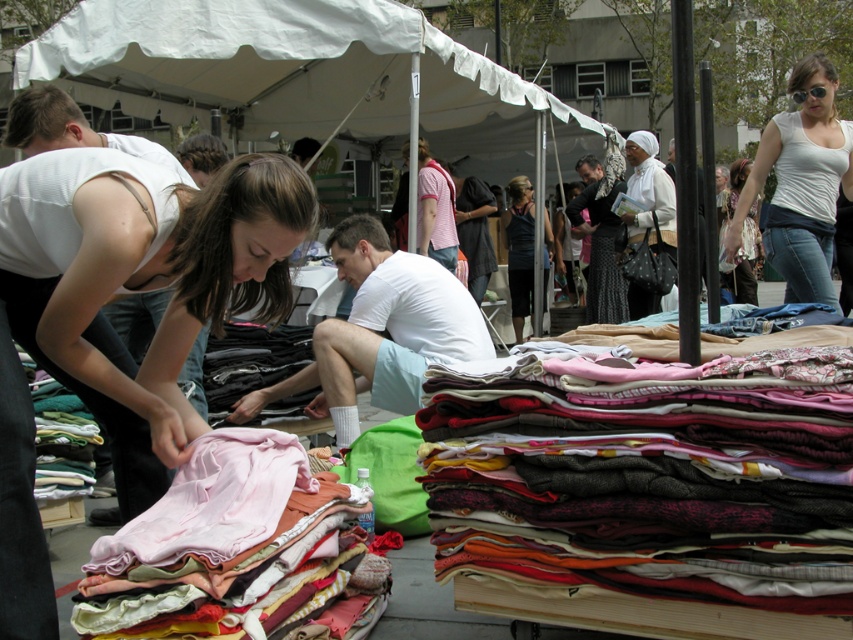
You are a customer at the market and want to buy the white cotton shorts at center. The vendor says they are on the table under the multicolored fabric stack at center. Can you see them from where you are standing?

The multicolored fabric stack at center is bigger than the white cotton shorts at center, so the white cotton shorts at center might be hidden underneath and not visible from your current position.

You are a customer at the market and want to pick up the white cotton shorts at center. Can you easily reach them without moving the multicolored fabric stack at center?

The multicolored fabric stack at center is positioned under the white cotton shorts at center, so you can easily reach the white cotton shorts at center without moving the stack since it is beneath them.